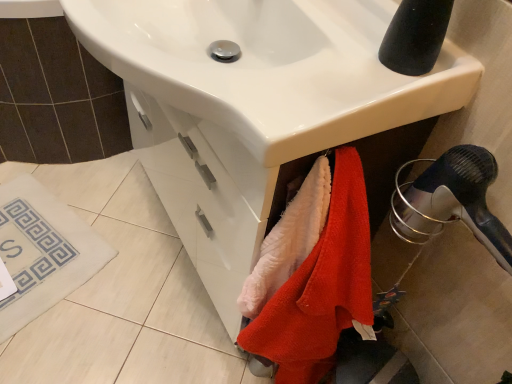
Question: From a real-world perspective, is fluffy pink towel at lower center, which is the first beach towel in top-to-bottom order, physically below white fabric bath mat at lower left?

Choices:
 (A) yes
 (B) no

Answer: (B)

Question: From the image's perspective, is fluffy pink towel at lower center, which is the first beach towel in top-to-bottom order, beneath white fabric bath mat at lower left?

Choices:
 (A) no
 (B) yes

Answer: (A)

Question: Does fluffy pink towel at lower center, which is the first beach towel in top-to-bottom order, have a greater width compared to white fabric bath mat at lower left?

Choices:
 (A) no
 (B) yes

Answer: (A)

Question: Is fluffy pink towel at lower center, acting as the second beach towel starting from the bottom, smaller than white fabric bath mat at lower left?

Choices:
 (A) yes
 (B) no

Answer: (A)

Question: Is fluffy pink towel at lower center, acting as the second beach towel starting from the bottom, outside white fabric bath mat at lower left?

Choices:
 (A) yes
 (B) no

Answer: (A)

Question: Considering the positions of point (395, 226) and point (18, 226), is point (395, 226) closer or farther from the camera than point (18, 226)?

Choices:
 (A) closer
 (B) farther

Answer: (A)

Question: From the image's perspective, is black plastic hair dryer at lower right above or below white fabric bath mat at lower left?

Choices:
 (A) above
 (B) below

Answer: (A)

Question: From a real-world perspective, relative to white fabric bath mat at lower left, is black plastic hair dryer at lower right vertically above or below?

Choices:
 (A) above
 (B) below

Answer: (A)

Question: Looking at their shapes, would you say black plastic hair dryer at lower right is wider or thinner than white fabric bath mat at lower left?

Choices:
 (A) thin
 (B) wide

Answer: (A)

Question: Is white fabric bath mat at lower left spatially inside white glossy sink at center, or outside of it?

Choices:
 (A) outside
 (B) inside

Answer: (A)

Question: From the image's perspective, is white fabric bath mat at lower left above or below white glossy sink at center?

Choices:
 (A) below
 (B) above

Answer: (A)

Question: From a real-world perspective, is white fabric bath mat at lower left physically located above or below white glossy sink at center?

Choices:
 (A) above
 (B) below

Answer: (B)

Question: Is white fabric bath mat at lower left to the left or to the right of white glossy sink at center in the image?

Choices:
 (A) right
 (B) left

Answer: (B)

Question: Is fluffy pink towel at lower center, which is the first beach towel in top-to-bottom order, bigger or smaller than white glossy sink at center?

Choices:
 (A) big
 (B) small

Answer: (B)

Question: From a real-world perspective, relative to white glossy sink at center, is fluffy pink towel at lower center, which is the first beach towel in top-to-bottom order, vertically above or below?

Choices:
 (A) above
 (B) below

Answer: (B)